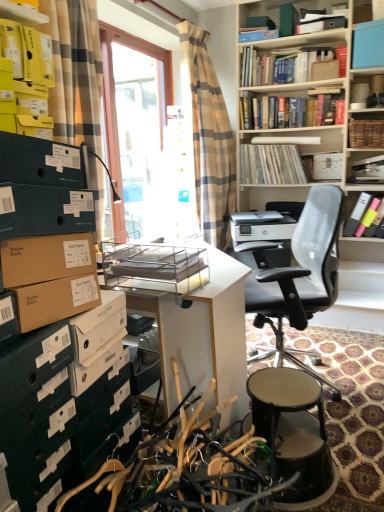
Locate an element on the screen. white mesh office chair at center is located at coordinates (301, 276).

Describe the element at coordinates (286, 65) in the screenshot. I see `hardcover book at upper center, which is the fourth book from bottom to top` at that location.

Locate an element on the screen. The image size is (384, 512). white matte printer at center is located at coordinates (262, 226).

What do you see at coordinates (262, 226) in the screenshot? This screenshot has height=512, width=384. I see `white matte printer at center` at bounding box center [262, 226].

The width and height of the screenshot is (384, 512). Describe the element at coordinates (27, 47) in the screenshot. I see `yellow cardboard boxes at upper left, which appears as the 2th shelf when ordered from the bottom` at that location.

Measure the distance between point (45, 53) and camera.

The distance of point (45, 53) from camera is 1.55 meters.

Describe the element at coordinates (362, 215) in the screenshot. I see `pastel matte highlighters at upper right, placed as the fourth book when sorted from top to bottom` at that location.

Find the location of a particular element. The image size is (384, 512). white mesh office chair at center is located at coordinates point(301,276).

From the image's perspective, which object appears higher, green cardboard boxes at lower left, placed as the first shelf when sorted from front to back, or hardcover book at upper center, arranged as the first book when viewed from the top?

hardcover book at upper center, arranged as the first book when viewed from the top.

Looking at the image, does green cardboard boxes at lower left, which is the 2th shelf from left to right, seem bigger or smaller compared to hardcover book at upper center, which is the fourth book from bottom to top?

In the image, green cardboard boxes at lower left, which is the 2th shelf from left to right, appears to be larger than hardcover book at upper center, which is the fourth book from bottom to top.

Where is `shelf that is the 3rd object directly below the hardcover book at upper center, which is the fourth book from bottom to top (from a real-world perspective)`? The width and height of the screenshot is (384, 512). shelf that is the 3rd object directly below the hardcover book at upper center, which is the fourth book from bottom to top (from a real-world perspective) is located at coordinates (56, 329).

Which is in front, point (112, 391) or point (300, 60)?

The point (112, 391) is closer to the camera.

This screenshot has width=384, height=512. Identify the location of window screen on the right of yellow cardboard boxes at upper left, which appears as the 2th shelf when ordered from the bottom. (113, 81).

Between yellow cardboard boxes at upper left, which is counted as the 2th shelf, starting from the front, and transparent glass door at center, which one appears on the left side from the viewer's perspective?

From the viewer's perspective, yellow cardboard boxes at upper left, which is counted as the 2th shelf, starting from the front, appears more on the left side.

Are yellow cardboard boxes at upper left, positioned as the 3th shelf in right-to-left order, and transparent glass door at center located far from each other?

yellow cardboard boxes at upper left, positioned as the 3th shelf in right-to-left order, is positioned a significant distance from transparent glass door at center.

Is yellow cardboard boxes at upper left, positioned as the 3th shelf in right-to-left order, in front of or behind transparent glass door at center in the image?

yellow cardboard boxes at upper left, positioned as the 3th shelf in right-to-left order, is in front of transparent glass door at center.

Looking at this image, considering the sizes of objects beige plaid curtain at center, the 1th curtain from the back, and pastel matte highlighters at upper right, the 1th book positioned from the bottom, in the image provided, who is thinner, beige plaid curtain at center, the 1th curtain from the back, or pastel matte highlighters at upper right, the 1th book positioned from the bottom,?

With smaller width is pastel matte highlighters at upper right, the 1th book positioned from the bottom.

I want to click on the 1st curtain to the left of the pastel matte highlighters at upper right, placed as the fourth book when sorted from top to bottom, starting your count from the anchor, so click(208, 137).

Is beige plaid curtain at center, arranged as the 2th curtain when viewed from the front, surrounding pastel matte highlighters at upper right, placed as the fourth book when sorted from top to bottom?

That's incorrect, pastel matte highlighters at upper right, placed as the fourth book when sorted from top to bottom, is not inside beige plaid curtain at center, arranged as the 2th curtain when viewed from the front.

How different are the orientations of wooden stool at lower right and matte white storage box at upper center in degrees?

They differ by 89.1 degrees in their facing directions.

Is wooden stool at lower right aimed at matte white storage box at upper center?

No, wooden stool at lower right is not facing towards matte white storage box at upper center.

Is wooden stool at lower right inside or outside of matte white storage box at upper center?

wooden stool at lower right lies outside matte white storage box at upper center.

Measure the distance between wooden stool at lower right and matte white storage box at upper center.

7.06 feet.

Is the surface of woven brown basket at upper right, the 1th shelf in the back-to-front sequence, in direct contact with white mesh office chair at center?

No, woven brown basket at upper right, the 1th shelf in the back-to-front sequence, is not with white mesh office chair at center.

Do you think woven brown basket at upper right, the 1th shelf in the back-to-front sequence, is within white mesh office chair at center, or outside of it?

woven brown basket at upper right, the 1th shelf in the back-to-front sequence, is outside white mesh office chair at center.

Does woven brown basket at upper right, the 3th shelf in the front-to-back sequence, turn towards white mesh office chair at center?

No, woven brown basket at upper right, the 3th shelf in the front-to-back sequence, does not turn towards white mesh office chair at center.

From the image's perspective, count 2nd shelfs upward from the white mesh office chair at center and point to it. Please provide its 2D coordinates.

[(365, 132)]

Would you say green cardboard boxes at lower left, the 2th shelf from the right, is inside or outside beige plaid curtain at center, arranged as the 2th curtain when viewed from the front?

green cardboard boxes at lower left, the 2th shelf from the right, is not enclosed by beige plaid curtain at center, arranged as the 2th curtain when viewed from the front.

Is green cardboard boxes at lower left, placed as the first shelf when sorted from front to back, with beige plaid curtain at center, arranged as the 2th curtain when viewed from the front?

No, green cardboard boxes at lower left, placed as the first shelf when sorted from front to back, is not in contact with beige plaid curtain at center, arranged as the 2th curtain when viewed from the front.

Considering the points (34, 350) and (233, 176), which point is behind, point (34, 350) or point (233, 176)?

The point (233, 176) is more distant.

Based on the photo, from a real-world perspective, relative to beige plaid curtain at center, the first curtain in the right-to-left sequence, is green cardboard boxes at lower left, which is the 3th shelf in top-to-bottom order, vertically above or below?

From a real-world perspective, green cardboard boxes at lower left, which is the 3th shelf in top-to-bottom order, is physically below beige plaid curtain at center, the first curtain in the right-to-left sequence.

Which of these two, blue plastic box at upper right or wooden vinyl records at upper center, which appears as the 2th book when ordered from the bottom, is smaller?

blue plastic box at upper right.

Who is taller, blue plastic box at upper right or wooden vinyl records at upper center, which appears as the 2th book when ordered from the bottom?

wooden vinyl records at upper center, which appears as the 2th book when ordered from the bottom.

Is wooden vinyl records at upper center, acting as the 3th book starting from the top, at the back of blue plastic box at upper right?

No, blue plastic box at upper right is not facing the opposite direction of wooden vinyl records at upper center, acting as the 3th book starting from the top.

Is blue plastic box at upper right in front of or behind wooden vinyl records at upper center, acting as the 3th book starting from the top, in the image?

Visually, blue plastic box at upper right is located in front of wooden vinyl records at upper center, acting as the 3th book starting from the top.

Which shelf is the 3rd one when counting from the front of the hardcover book at upper center, arranged as the first book when viewed from the top? Please provide its 2D coordinates.

[(56, 329)]

Image resolution: width=384 pixels, height=512 pixels. Find the location of `window screen on the right of yellow cardboard boxes at upper left, the second shelf viewed from the back`. window screen on the right of yellow cardboard boxes at upper left, the second shelf viewed from the back is located at coordinates (113, 81).

Estimate the real-world distances between objects in this image. Which object is closer to hardcover book at upper center, arranged as the first book when viewed from the top, white matte printer at center or blue plastic box at upper right?

Based on the image, blue plastic box at upper right appears to be nearer to hardcover book at upper center, arranged as the first book when viewed from the top.

Looking at this image, estimate the real-world distances between objects in this image. Which object is further from transparent glass door at center, wooden vinyl records at upper center, acting as the 3th book starting from the top, or hardcover book at upper center, which is the fourth book from bottom to top?

wooden vinyl records at upper center, acting as the 3th book starting from the top, is further to transparent glass door at center.

Estimate the real-world distances between objects in this image. Which object is further from hardcover book at upper center, acting as the third book starting from the bottom, beige plaid curtain at center, the first curtain in the right-to-left sequence, or blue plastic box at upper right?

blue plastic box at upper right lies further to hardcover book at upper center, acting as the third book starting from the bottom, than the other object.

From the image, which object appears to be nearer to white mesh office chair at center, matte white storage box at upper center or blue plastic box at upper right?

The object closer to white mesh office chair at center is matte white storage box at upper center.

Based on their spatial positions, is white glossy desk at center or hardcover book at upper center, acting as the third book starting from the bottom, further from wooden vinyl records at upper center, which appears as the 2th book when ordered from the bottom?

white glossy desk at center is further to wooden vinyl records at upper center, which appears as the 2th book when ordered from the bottom.

From the image, which object appears to be farther from green cardboard boxes at lower left, which is the third shelf in back-to-front order, white matte printer at center or beige plaid curtain at left, which is the 1th curtain from left to right?

white matte printer at center is positioned further to the anchor green cardboard boxes at lower left, which is the third shelf in back-to-front order.

Based on their spatial positions, is beige plaid curtain at center, the 2th curtain from the left, or transparent glass door at center further from woven brown basket at upper right, which is the third shelf from left to right?

Based on the image, transparent glass door at center appears to be further to woven brown basket at upper right, which is the third shelf from left to right.

Which object lies nearer to the anchor point transparent glass door at center, beige plaid curtain at left, positioned as the 2th curtain in right-to-left order, or hardcover book at upper center, which is the 2th book from top to bottom?

Among the two, beige plaid curtain at left, positioned as the 2th curtain in right-to-left order, is located nearer to transparent glass door at center.

What are the coordinates of `book between hardcover book at upper center, acting as the third book starting from the bottom, and matte white storage box at upper center in the up-down direction` in the screenshot? It's located at (271, 164).

I want to click on desk between yellow cardboard boxes at upper left, which is counted as the 2th shelf, starting from the front, and beige plaid curtain at center, arranged as the 2th curtain when viewed from the front, along the z-axis, so click(x=191, y=320).

Locate an element on the screen. The height and width of the screenshot is (512, 384). desk between green cardboard boxes at lower left, which is the 3th shelf in top-to-bottom order, and hardcover book at upper center, acting as the third book starting from the bottom, in the front-back direction is located at coordinates (191, 320).

In order to click on box between hardcover book at upper center, which is the fourth book from bottom to top, and wooden vinyl records at upper center, which appears as the 2th book when ordered from the bottom, from top to bottom in this screenshot , I will do `click(368, 44)`.